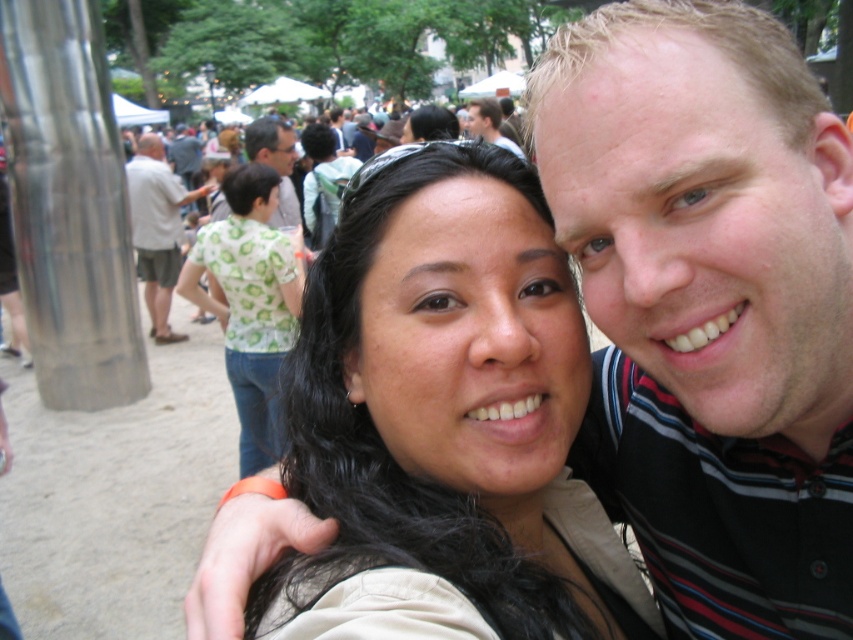
Is light gray cotton shorts at left above dark brown leather jacket at upper center?

No, light gray cotton shorts at left is not above dark brown leather jacket at upper center.

Which is above, light gray cotton shorts at left or dark brown leather jacket at upper center?

Positioned higher is dark brown leather jacket at upper center.

Is point (154, 179) positioned after point (474, 100)?

That is True.

Image resolution: width=853 pixels, height=640 pixels. In order to click on light gray cotton shorts at left in this screenshot , I will do `click(157, 228)`.

Does green leafy shirt at center have a lesser height compared to light gray cotton shorts at left?

Correct, green leafy shirt at center is not as tall as light gray cotton shorts at left.

Does green leafy shirt at center have a lesser width compared to light gray cotton shorts at left?

No, green leafy shirt at center is not thinner than light gray cotton shorts at left.

Between point (224, 188) and point (190, 198), which one is positioned in front?

Point (224, 188)

Identify the location of green leafy shirt at center. This screenshot has height=640, width=853. (250, 301).

Does green leafy shirt at center have a larger size compared to dark brown leather jacket at upper center?

Actually, green leafy shirt at center might be smaller than dark brown leather jacket at upper center.

Is point (292, 310) farther from viewer compared to point (497, 106)?

That is False.

Find the location of a particular element. The image size is (853, 640). green leafy shirt at center is located at coordinates (250, 301).